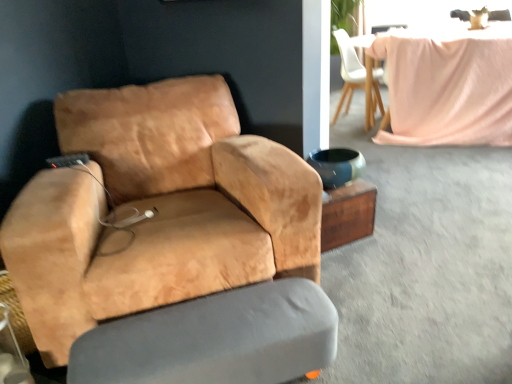
Where is `free location above gray fabric swivel chair at lower center (from a real-world perspective)`? This screenshot has height=384, width=512. free location above gray fabric swivel chair at lower center (from a real-world perspective) is located at coordinates (204, 326).